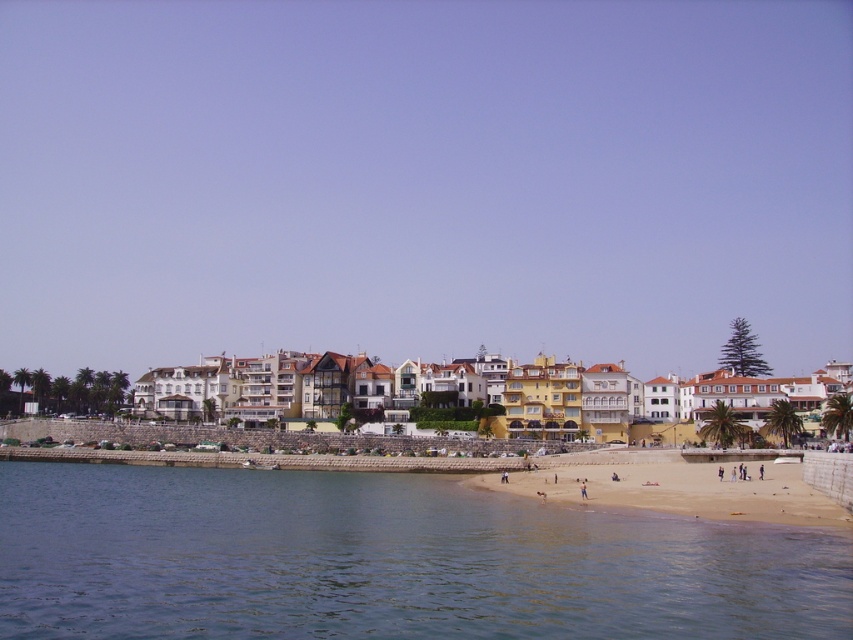
Who is more distant from viewer, (328, 500) or (837, 506)?

The point (328, 500) is more distant.

Who is shorter, clear blue water at lower left or light brown sand at lower center?

clear blue water at lower left

The height and width of the screenshot is (640, 853). Describe the element at coordinates (387, 561) in the screenshot. I see `clear blue water at lower left` at that location.

Where is `clear blue water at lower left`? The image size is (853, 640). clear blue water at lower left is located at coordinates (387, 561).